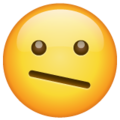
Where is `white light`? white light is located at coordinates (61, 18).